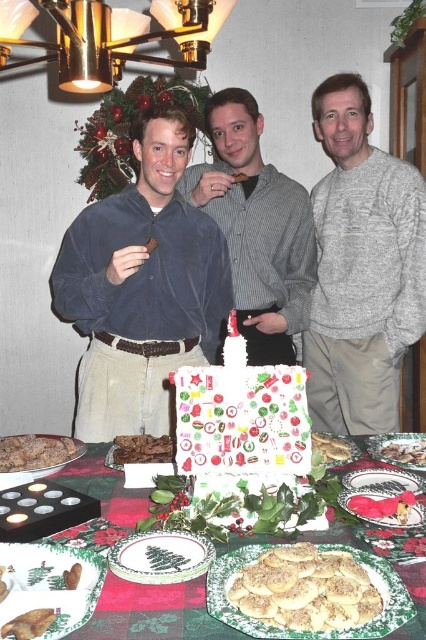
Question: Can you confirm if gray sweater at right is thinner than matte blue sweater at center?

Choices:
 (A) no
 (B) yes

Answer: (B)

Question: Which object appears farthest from the camera in this image?

Choices:
 (A) green matte platter at center
 (B) crumbly brown cookie at center
 (C) matte white platter at center
 (D) brown crumbly cake at center

Answer: (B)

Question: Which object is farther from the camera taking this photo?

Choices:
 (A) brown crumbly cookie at lower left
 (B) green plaid tablecloth at center
 (C) striped shirt at center

Answer: (C)

Question: Can you confirm if green matte platter at center is positioned above matte white platter at center?

Choices:
 (A) yes
 (B) no

Answer: (B)

Question: Does velvet blue shirt at center have a larger size compared to crispy golden cookies at center?

Choices:
 (A) yes
 (B) no

Answer: (A)

Question: Which object appears closest to the camera in this image?

Choices:
 (A) velvet blue shirt at center
 (B) striped shirt at center

Answer: (A)